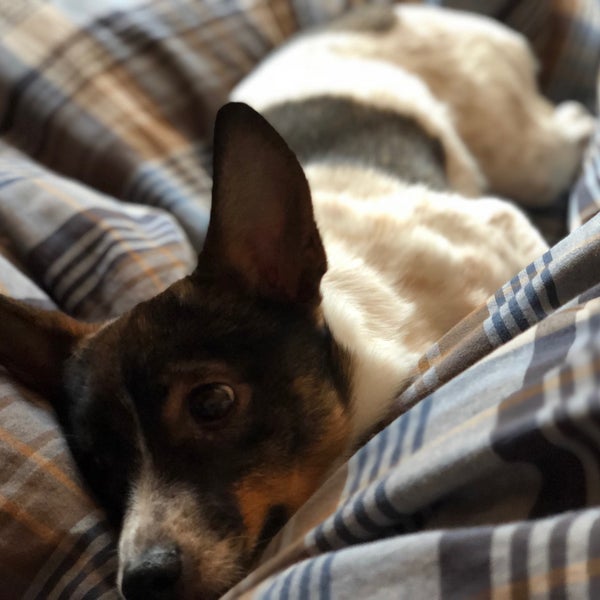
At what (x,y) coordinates should I click in order to perform the action: click on white fur. Please return your answer as a coordinate pair (x, y). Looking at the image, I should click on (454, 44), (418, 276), (190, 530), (132, 513), (219, 559).